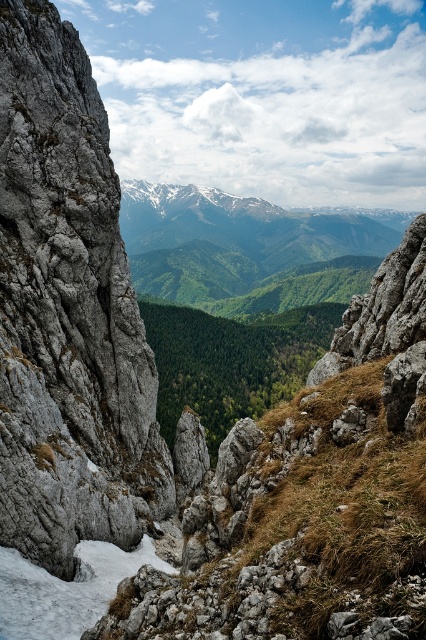
Is point (63, 522) farther from camera compared to point (26, 561)?

Yes, it is behind point (26, 561).

Does gray rough rock at left have a greater width compared to white frosty snow at lower left?

Indeed, gray rough rock at left has a greater width compared to white frosty snow at lower left.

The image size is (426, 640). Find the location of `gray rough rock at left`. gray rough rock at left is located at coordinates (68, 312).

Find the location of `gray rough rock at left`. gray rough rock at left is located at coordinates (68, 312).